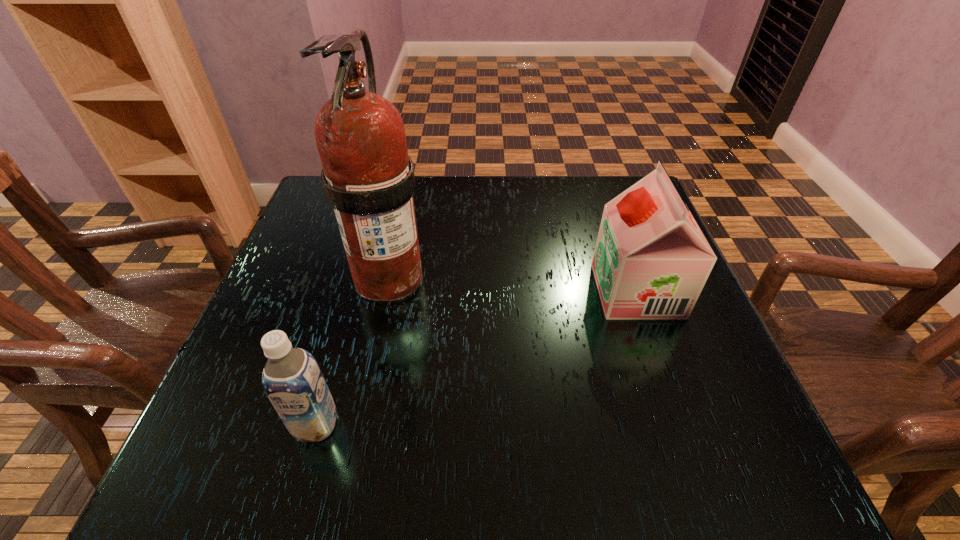
At what (x,y) coordinates should I click in order to perform the action: click on vacant space that's between the tallest object and the shorter soya milk. Please return your answer as a coordinate pair (x, y). The image size is (960, 540). Looking at the image, I should click on (352, 350).

Where is `free space between the fire extinguisher and the rightmost object`? The width and height of the screenshot is (960, 540). free space between the fire extinguisher and the rightmost object is located at coordinates (513, 283).

Locate an element on the screen. free point between the tallest object and the left soya milk is located at coordinates (352, 350).

Locate an element on the screen. The width and height of the screenshot is (960, 540). free space that is in between the taller soya milk and the nearer soya milk is located at coordinates (476, 357).

You are a GUI agent. You are given a task and a screenshot of the screen. Output one action in this format:
    pyautogui.click(x=<x>, y=<y>)
    Task: Click on the vacant region between the farther soya milk and the left soya milk
    The width and height of the screenshot is (960, 540).
    Given the screenshot: What is the action you would take?
    pyautogui.click(x=476, y=357)

The height and width of the screenshot is (540, 960). What are the coordinates of `free area in between the nearer soya milk and the farther soya milk` in the screenshot? It's located at (476, 357).

Find the location of a particular element. Image resolution: width=960 pixels, height=540 pixels. blank region between the right soya milk and the nearer soya milk is located at coordinates (476, 357).

Find the location of `empty location between the second shortest object and the shortest object`. empty location between the second shortest object and the shortest object is located at coordinates (476, 357).

Identify the location of object that is the second nearest to the right soya milk. (292, 379).

Select which object is the closest to the taller soya milk. Please provide its 2D coordinates. Your answer should be formatted as a tuple, i.e. [(x, y)], where the tuple contains the x and y coordinates of a point satisfying the conditions above.

[(368, 177)]